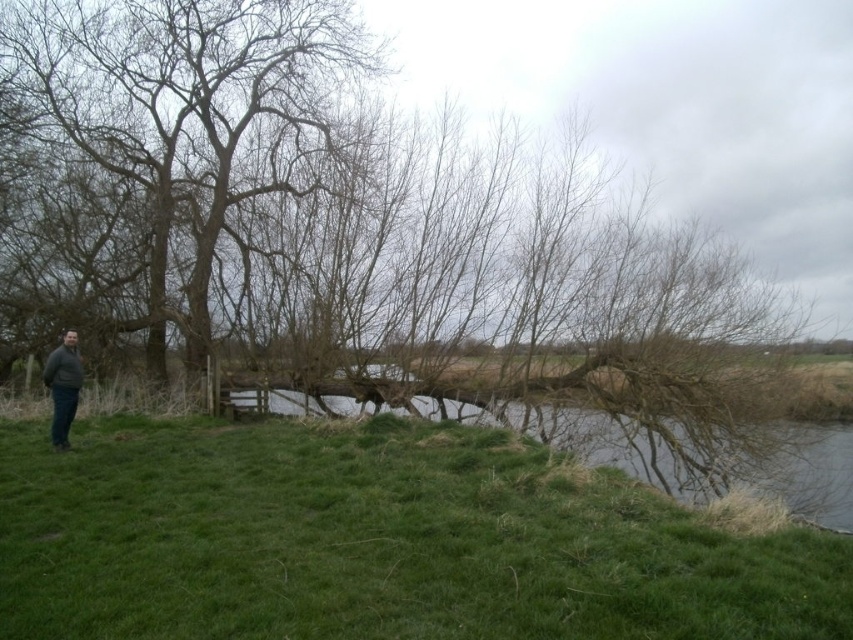
You are planning to set up a picnic area and have a picnic blanket that can cover an area of 2 square meters. You see the green grassy at lower left and the brown grassy river at center. Which area is more suitable for placing your picnic blanket based on their sizes?

The green grassy at lower left has a smaller size compared to the brown grassy river at center. Since your picnic blanket covers 2 square meters, the brown grassy river at center is more suitable as it can accommodate the larger area required.

Consider the image. You are a hiker who wants to take a photo of the dark gray sweater at lower left and the bare wood tree at left. Which object should you focus on first if you want to capture both in the same frame without moving the camera?

The dark gray sweater at lower left is taller than the bare wood tree at left, so you should focus on the dark gray sweater at lower left first to ensure both are in focus.